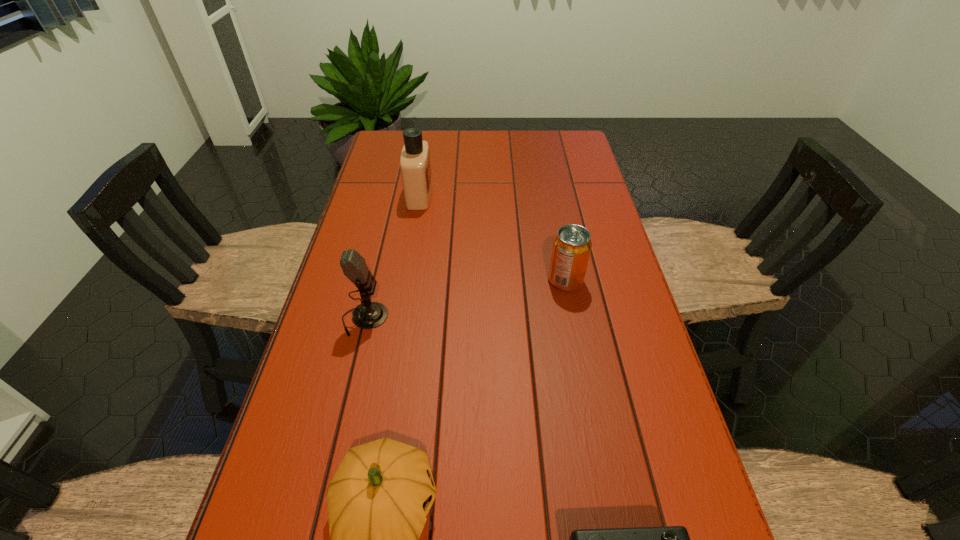
Locate an element on the screen. The width and height of the screenshot is (960, 540). vacant space at the right edge of the desktop is located at coordinates pos(565,213).

Where is `vacant position at the far right corner of the desktop`? Image resolution: width=960 pixels, height=540 pixels. vacant position at the far right corner of the desktop is located at coordinates (572, 155).

Locate an element on the screen. This screenshot has width=960, height=540. vacant space that is in between the microphone and the soda can is located at coordinates [x=465, y=300].

This screenshot has width=960, height=540. I want to click on free space between the soda can and the perfume, so 492,238.

At what (x,y) coordinates should I click in order to perform the action: click on free space that is in between the soda can and the microphone. Please return your answer as a coordinate pair (x, y). The image size is (960, 540). Looking at the image, I should click on (465, 300).

Identify the location of vacant space in between the microphone and the soda can. (465, 300).

Point out which object is positioned as the fourth nearest to the microphone. Please provide its 2D coordinates. Your answer should be formatted as a tuple, i.e. [(x, y)], where the tuple contains the x and y coordinates of a point satisfying the conditions above.

[(669, 539)]

Locate an element on the screen. Image resolution: width=960 pixels, height=540 pixels. object that is the second closest to the second farthest object is located at coordinates (415, 164).

Find the location of a particular element. free spot that satisfies the following two spatial constraints: 1. on the front side of the second farthest object; 2. on the front-facing side of the third farthest object is located at coordinates (573, 319).